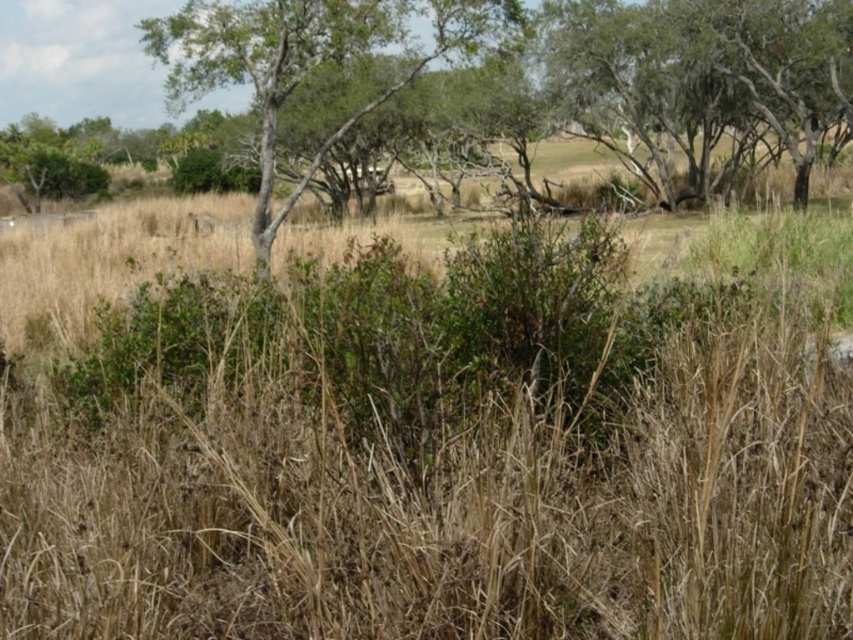
Which is more to the right, green rough bark tree at upper right or green leafy tree at center?

From the viewer's perspective, green rough bark tree at upper right appears more on the right side.

Is green rough bark tree at upper right below green leafy tree at center?

Yes.

Where is `green rough bark tree at upper right`? green rough bark tree at upper right is located at coordinates (700, 83).